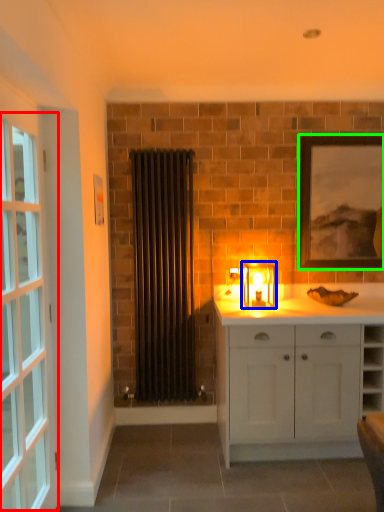
Question: Based on their relative distances, which object is nearer to window (highlighted by a red box)? Choose from candle holder (highlighted by a blue box) and picture frame (highlighted by a green box).

Choices:
 (A) candle holder
 (B) picture frame

Answer: (A)